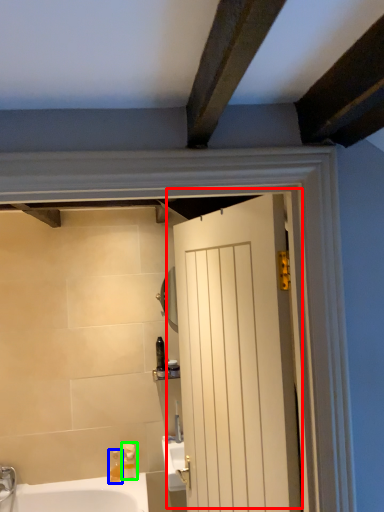
Question: Which object is positioned farthest from door (highlighted by a red box)? Select from soap dispenser (highlighted by a blue box) and soap dispenser (highlighted by a green box).

Choices:
 (A) soap dispenser
 (B) soap dispenser

Answer: (A)